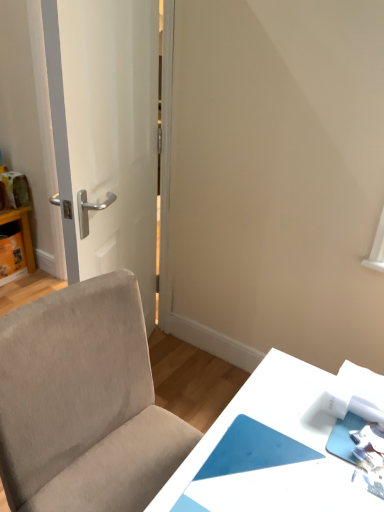
Image resolution: width=384 pixels, height=512 pixels. In order to click on blank space above white glossy table at lower right, which is the 2th table in left-to-right order (from a real-world perspective) in this screenshot , I will do `click(280, 440)`.